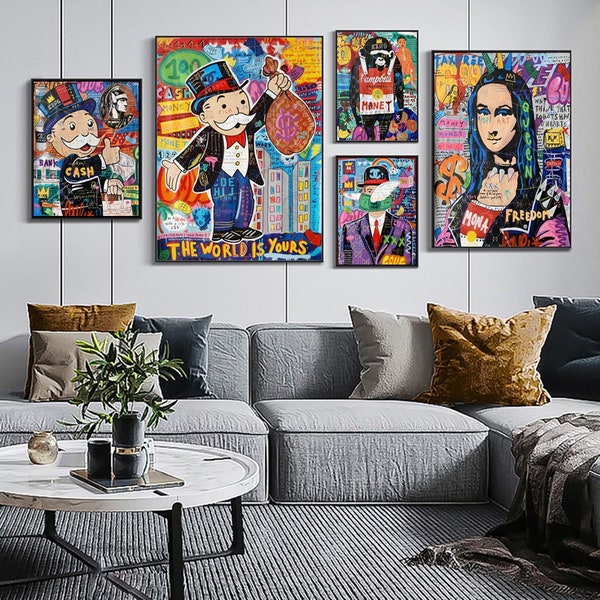
I want to click on pillows, so click(x=406, y=344), click(x=453, y=342), click(x=569, y=333), click(x=176, y=333), click(x=51, y=319), click(x=54, y=338).